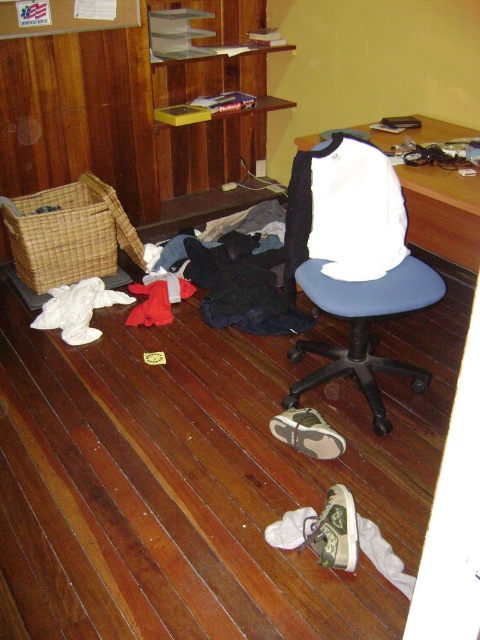
Is blue fabric swivel chair at center taller than wooden desk at center?

Yes.

Does point (343, 144) come behind point (468, 240)?

No.

Image resolution: width=480 pixels, height=640 pixels. Describe the element at coordinates (348, 291) in the screenshot. I see `blue fabric swivel chair at center` at that location.

Where is `blue fabric swivel chair at center`? The width and height of the screenshot is (480, 640). blue fabric swivel chair at center is located at coordinates (348, 291).

Can you confirm if wooden desk at center is thinner than white canvas shoe at lower center?

Incorrect, wooden desk at center's width is not less than white canvas shoe at lower center's.

Does point (422, 218) come farther from viewer compared to point (316, 518)?

Yes, point (422, 218) is behind point (316, 518).

Does point (472, 253) lie in front of point (328, 504)?

That is False.

This screenshot has width=480, height=640. Identify the location of wooden desk at center. (443, 212).

In the scene shown: Can you confirm if white canvas shoe at lower center is wider than tan suede shoe at lower center?

In fact, white canvas shoe at lower center might be narrower than tan suede shoe at lower center.

Where is `white canvas shoe at lower center`? The image size is (480, 640). white canvas shoe at lower center is located at coordinates (335, 531).

In order to click on white canvas shoe at lower center in this screenshot , I will do `click(335, 531)`.